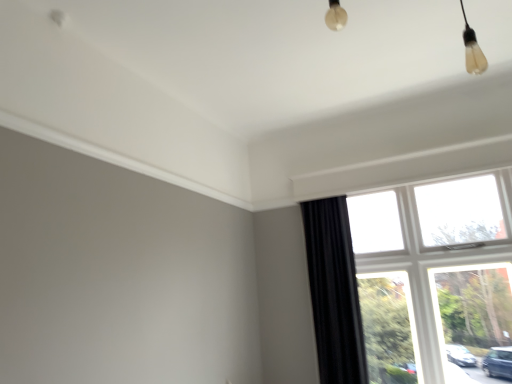
What do you see at coordinates (334, 292) in the screenshot?
I see `black velvet curtain at right` at bounding box center [334, 292].

Measure the distance between point (345,338) and camera.

The distance of point (345,338) from camera is 3.08 meters.

Measure the distance between black velvet curtain at right and camera.

The depth of black velvet curtain at right is 9.79 feet.

Identify the location of black velvet curtain at right. (334, 292).

This screenshot has height=384, width=512. Identify the location of white plastic window at right. (432, 274).

What do you see at coordinates (432, 274) in the screenshot? I see `white plastic window at right` at bounding box center [432, 274].

Where is `black velvet curtain at right`? black velvet curtain at right is located at coordinates (334, 292).

Considering the positions of objects white plastic window at right and black velvet curtain at right in the image provided, who is more to the right, white plastic window at right or black velvet curtain at right?

Positioned to the right is white plastic window at right.

Based on the photo, is white plastic window at right behind black velvet curtain at right?

No, white plastic window at right is closer to the viewer.

Is point (459, 201) closer or farther from the camera than point (304, 210)?

Point (459, 201) is closer to the camera than point (304, 210).

From the image's perspective, is white plastic window at right above or below black velvet curtain at right?

white plastic window at right is situated higher than black velvet curtain at right in the image.

From a real-world perspective, is white plastic window at right positioned under black velvet curtain at right based on gravity?

Indeed, from a real-world perspective, white plastic window at right is positioned beneath black velvet curtain at right.

Considering the sizes of objects white plastic window at right and black velvet curtain at right in the image provided, who is wider, white plastic window at right or black velvet curtain at right?

black velvet curtain at right is wider.

Considering the sizes of white plastic window at right and black velvet curtain at right in the image, is white plastic window at right taller or shorter than black velvet curtain at right?

white plastic window at right is taller than black velvet curtain at right.

Is white plastic window at right bigger or smaller than black velvet curtain at right?

In the image, white plastic window at right appears to be larger than black velvet curtain at right.

Is white plastic window at right inside the boundaries of black velvet curtain at right, or outside?

white plastic window at right is spatially situated outside black velvet curtain at right.

Is there a large distance between white plastic window at right and black velvet curtain at right?

Actually, white plastic window at right and black velvet curtain at right are a little close together.

Is white plastic window at right positioned with its back to black velvet curtain at right?

No, white plastic window at right's orientation is not away from black velvet curtain at right.

Where is `window above the black velvet curtain at right (from the image's perspective)`? This screenshot has height=384, width=512. window above the black velvet curtain at right (from the image's perspective) is located at coordinates (432, 274).

Can you confirm if black velvet curtain at right is positioned to the right of white plastic window at right?

No, black velvet curtain at right is not to the right of white plastic window at right.

Is black velvet curtain at right positioned in front of white plastic window at right?

No, the depth of black velvet curtain at right is greater than that of white plastic window at right.

Considering the positions of points (317, 230) and (429, 281), is point (317, 230) farther from camera compared to point (429, 281)?

Yes, point (317, 230) is behind point (429, 281).

From the image's perspective, is black velvet curtain at right located above white plastic window at right?

No, from the image's perspective, black velvet curtain at right is not above white plastic window at right.

From a real-world perspective, is black velvet curtain at right below white plastic window at right?

No.

Considering the sizes of objects black velvet curtain at right and white plastic window at right in the image provided, who is thinner, black velvet curtain at right or white plastic window at right?

With smaller width is white plastic window at right.

Which of these two, black velvet curtain at right or white plastic window at right, stands taller?

white plastic window at right is taller.

Who is bigger, black velvet curtain at right or white plastic window at right?

white plastic window at right is bigger.

Is black velvet curtain at right not inside white plastic window at right?

black velvet curtain at right lies outside white plastic window at right's area.

Would you say black velvet curtain at right is a long distance from white plastic window at right?

No, black velvet curtain at right is in close proximity to white plastic window at right.

Is black velvet curtain at right oriented away from white plastic window at right?

black velvet curtain at right is not turned away from white plastic window at right.

Locate an element on the screen. curtain located below the white plastic window at right (from the image's perspective) is located at coordinates (334, 292).

At what (x,y) coordinates should I click in order to perform the action: click on curtain that is below the white plastic window at right (from the image's perspective). Please return your answer as a coordinate pair (x, y). Looking at the image, I should click on (334, 292).

Image resolution: width=512 pixels, height=384 pixels. I want to click on curtain above the white plastic window at right (from a real-world perspective), so click(x=334, y=292).